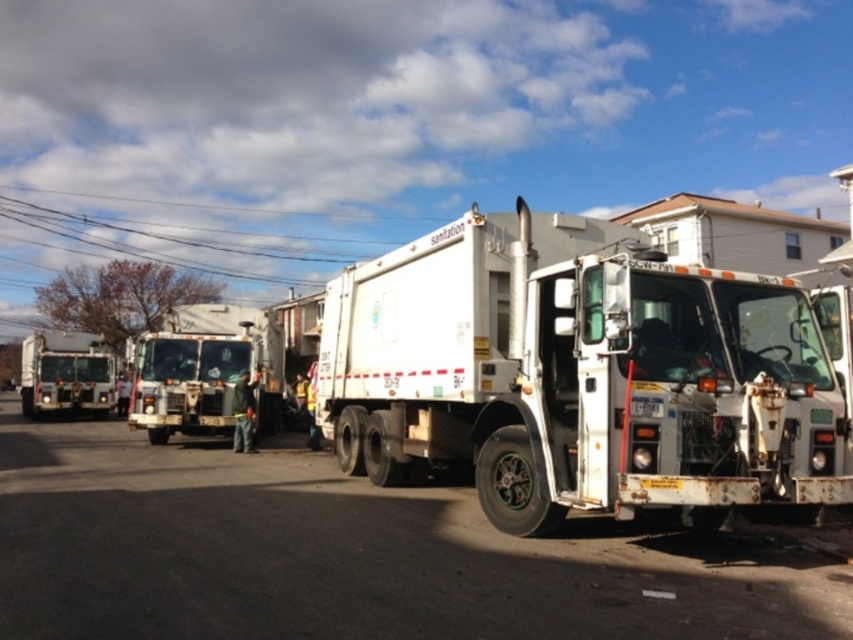
Question: Does white matte sanitation truck at center appear under white glossy garbage truck at left?

Choices:
 (A) no
 (B) yes

Answer: (A)

Question: Based on their relative distances, which object is farther from the white matte garbage truck at center?

Choices:
 (A) white glossy garbage truck at left
 (B) white matte sanitation truck at center

Answer: (A)

Question: Which object appears farthest from the camera in this image?

Choices:
 (A) white matte sanitation truck at center
 (B) white matte garbage truck at center
 (C) white glossy garbage truck at left

Answer: (C)

Question: Which point is closer to the camera taking this photo?

Choices:
 (A) (164, 353)
 (B) (663, 362)
 (C) (90, 352)

Answer: (B)

Question: Can you confirm if white matte garbage truck at center is positioned below white glossy garbage truck at left?

Choices:
 (A) no
 (B) yes

Answer: (A)

Question: Can you confirm if white matte garbage truck at center is positioned below white glossy garbage truck at left?

Choices:
 (A) yes
 (B) no

Answer: (B)